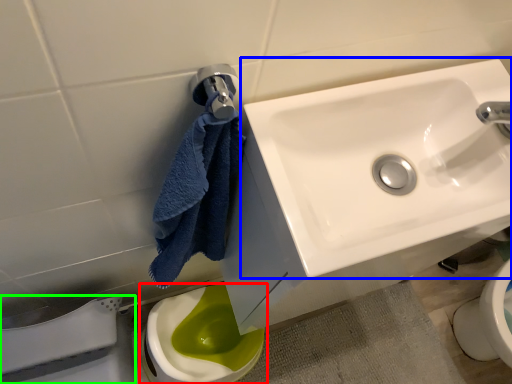
Question: Which object is the farthest from toilet (highlighted by a red box)? Choose among these: sink (highlighted by a blue box) or porcelain (highlighted by a green box).

Choices:
 (A) sink
 (B) porcelain

Answer: (A)